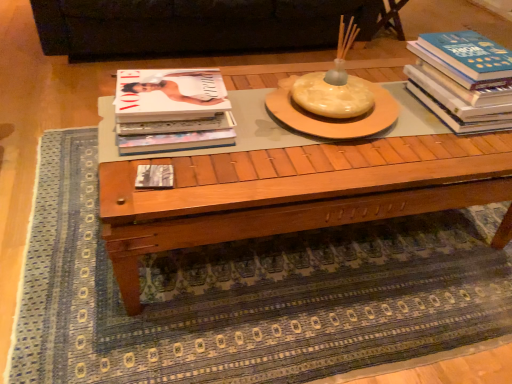
Question: Is matte white magazine at left, which is the 2th book in left-to-right order, positioned behind black leather couch at upper center?

Choices:
 (A) yes
 (B) no

Answer: (B)

Question: Does matte white magazine at left, which appears as the 2th book when viewed from the right, have a smaller size compared to black leather couch at upper center?

Choices:
 (A) yes
 (B) no

Answer: (A)

Question: From the image's perspective, does matte white magazine at left, which appears as the 2th book when viewed from the right, appear higher than black leather couch at upper center?

Choices:
 (A) yes
 (B) no

Answer: (B)

Question: From a real-world perspective, is matte white magazine at left, which appears as the 2th book when viewed from the right, beneath black leather couch at upper center?

Choices:
 (A) no
 (B) yes

Answer: (A)

Question: Considering the relative positions of matte white magazine at left, which is the 2th book in left-to-right order, and black leather couch at upper center in the image provided, is matte white magazine at left, which is the 2th book in left-to-right order, to the left of black leather couch at upper center from the viewer's perspective?

Choices:
 (A) yes
 (B) no

Answer: (B)

Question: From their relative heights in the image, would you say wooden coffee table at center is taller or shorter than matte black book at center, marked as the third book in a right-to-left arrangement?

Choices:
 (A) short
 (B) tall

Answer: (B)

Question: In the image, is wooden coffee table at center on the left side or the right side of matte black book at center, arranged as the first book when viewed from the left?

Choices:
 (A) left
 (B) right

Answer: (B)

Question: Based on their sizes in the image, would you say wooden coffee table at center is bigger or smaller than matte black book at center, arranged as the first book when viewed from the left?

Choices:
 (A) small
 (B) big

Answer: (B)

Question: Which is correct: wooden coffee table at center is inside matte black book at center, marked as the third book in a right-to-left arrangement, or outside of it?

Choices:
 (A) outside
 (B) inside

Answer: (A)

Question: Is matte black book at center, marked as the third book in a right-to-left arrangement, inside or outside of blue hardcover book at right, which ranks as the third book in left-to-right order?

Choices:
 (A) inside
 (B) outside

Answer: (B)

Question: From a real-world perspective, is matte black book at center, marked as the third book in a right-to-left arrangement, physically located above or below blue hardcover book at right, which ranks as the third book in left-to-right order?

Choices:
 (A) above
 (B) below

Answer: (B)

Question: Considering the positions of matte black book at center, marked as the third book in a right-to-left arrangement, and blue hardcover book at right, which ranks as the third book in left-to-right order, in the image, is matte black book at center, marked as the third book in a right-to-left arrangement, bigger or smaller than blue hardcover book at right, which ranks as the third book in left-to-right order,?

Choices:
 (A) small
 (B) big

Answer: (A)

Question: Considering the positions of matte black book at center, marked as the third book in a right-to-left arrangement, and blue hardcover book at right, which appears as the first book when viewed from the right, in the image, is matte black book at center, marked as the third book in a right-to-left arrangement, taller or shorter than blue hardcover book at right, which appears as the first book when viewed from the right,?

Choices:
 (A) short
 (B) tall

Answer: (A)

Question: Is wooden coffee table at center to the left or to the right of matte white magazine at left, which appears as the 2th book when viewed from the right, in the image?

Choices:
 (A) right
 (B) left

Answer: (A)

Question: Considering their positions, is wooden coffee table at center located in front of or behind matte white magazine at left, which appears as the 2th book when viewed from the right?

Choices:
 (A) behind
 (B) front

Answer: (B)